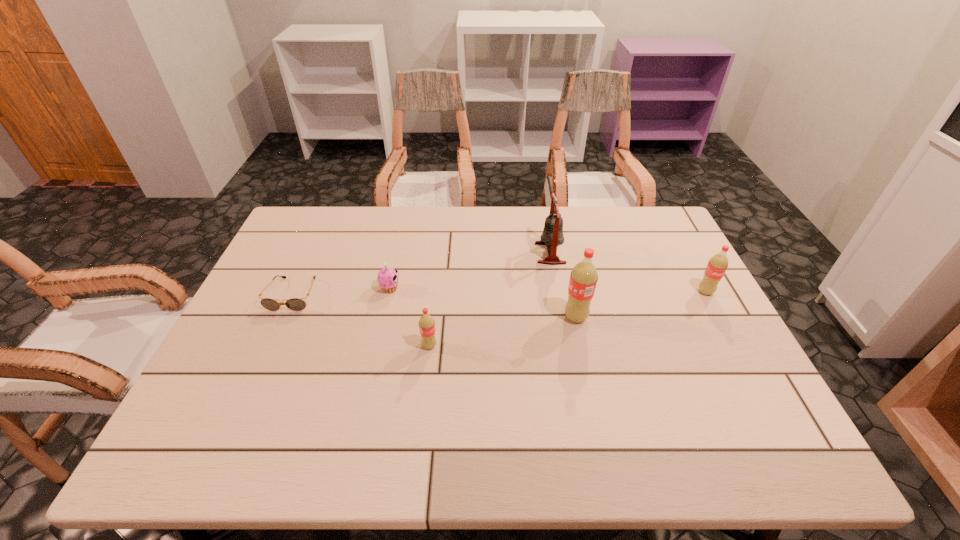
Identify the location of soda object that ranks as the closest to the shortest object. Image resolution: width=960 pixels, height=540 pixels. (426, 323).

Locate an element on the screen. This screenshot has height=540, width=960. vacant space that satisfies the following two spatial constraints: 1. on the face of the fifth tallest object; 2. on the left side of the second nearest soda is located at coordinates (383, 317).

The image size is (960, 540). I want to click on vacant space that satisfies the following two spatial constraints: 1. on the front side of the bell; 2. on the right side of the rightmost soda, so click(x=558, y=292).

Find the location of a particular element. This screenshot has height=540, width=960. vacant point that satisfies the following two spatial constraints: 1. on the back side of the farthest object; 2. on the right side of the nearest object is located at coordinates (440, 253).

You are a GUI agent. You are given a task and a screenshot of the screen. Output one action in this format:
    pyautogui.click(x=<x>, y=<y>)
    Task: Click on the free location that satisfies the following two spatial constraints: 1. on the lenses of the shortest object; 2. on the right side of the third shortest object
    The image size is (960, 540).
    Given the screenshot: What is the action you would take?
    pyautogui.click(x=270, y=346)

This screenshot has height=540, width=960. I want to click on free location that satisfies the following two spatial constraints: 1. on the face of the shortest soda; 2. on the left side of the second object from left to right, so click(377, 346).